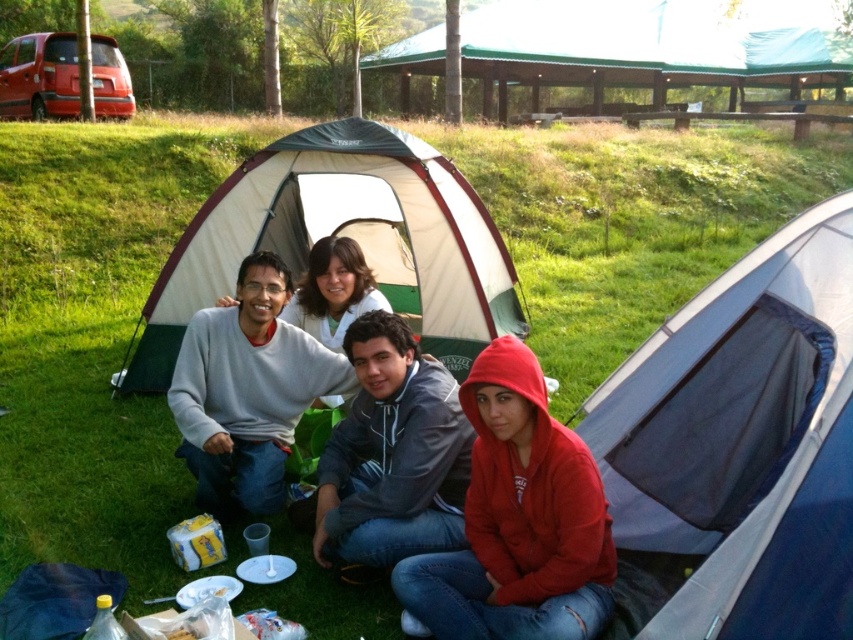
Question: Among these points, which one is farthest from the camera?

Choices:
 (A) (364, 147)
 (B) (534, 506)

Answer: (A)

Question: Which object is the closest to the white canvas tent at center?

Choices:
 (A) gray fleece hoodie at center
 (B) gray matte sweater at center
 (C) red fleece hoodie at lower right
 (D) blue fabric tent at center

Answer: (B)

Question: Observing the image, what is the correct spatial positioning of blue fabric tent at center in reference to gray matte sweater at center?

Choices:
 (A) left
 (B) right

Answer: (B)

Question: Does blue fabric tent at center come in front of red fleece hoodie at lower right?

Choices:
 (A) no
 (B) yes

Answer: (B)

Question: Is red fleece hoodie at lower right to the left of gray matte sweater at center from the viewer's perspective?

Choices:
 (A) yes
 (B) no

Answer: (B)

Question: Among these objects, which one is nearest to the camera?

Choices:
 (A) white canvas tent at center
 (B) gray fleece hoodie at center

Answer: (B)